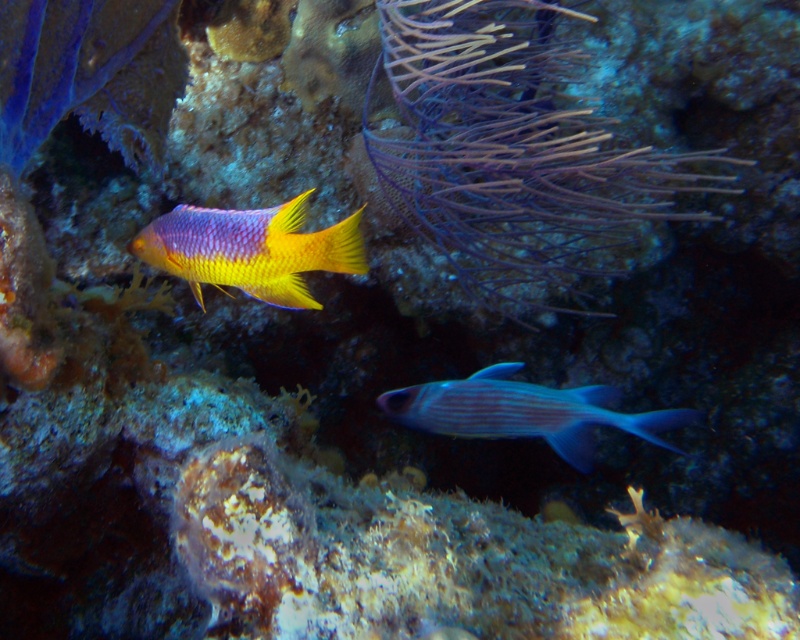
Question: Which point is closer to the camera?

Choices:
 (A) purple glossy fish at lower center
 (B) shiny yellow fish at center
 (C) purple soft coral at upper center

Answer: (B)

Question: Which of the following is the farthest from the observer?

Choices:
 (A) purple soft coral at upper center
 (B) shiny yellow fish at center
 (C) purple glossy fish at lower center

Answer: (C)

Question: Is purple soft coral at upper center thinner than shiny yellow fish at center?

Choices:
 (A) no
 (B) yes

Answer: (A)

Question: Which point appears farthest from the camera in this image?

Choices:
 (A) (550, 208)
 (B) (644, 417)

Answer: (A)

Question: Can you confirm if purple soft coral at upper center is positioned above shiny yellow fish at center?

Choices:
 (A) yes
 (B) no

Answer: (A)

Question: Can you confirm if shiny yellow fish at center is bigger than purple glossy fish at lower center?

Choices:
 (A) no
 (B) yes

Answer: (A)